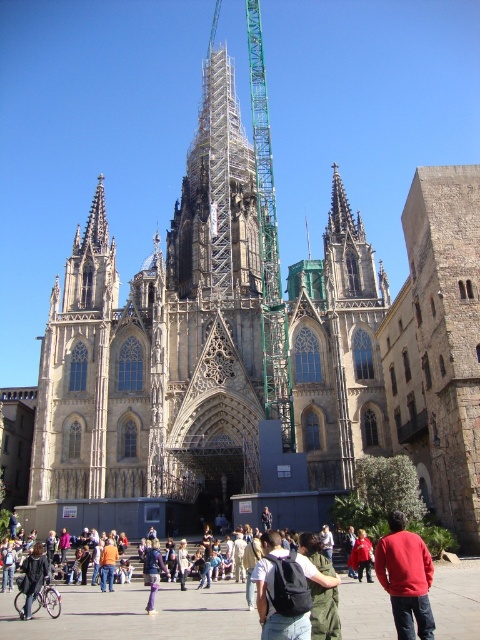
Can you confirm if red cotton sweater at center is positioned below red cotton shirt at center?

No, red cotton sweater at center is not below red cotton shirt at center.

Between point (410, 566) and point (357, 564), which one is positioned in front?

Point (410, 566) is in front.

At what (x,y) coordinates should I click in order to perform the action: click on red cotton sweater at center. Please return your answer as a coordinate pair (x, y). Image resolution: width=480 pixels, height=640 pixels. Looking at the image, I should click on (406, 577).

Which is more to the left, red cotton sweater at center or denim jacket at lower left?

denim jacket at lower left is more to the left.

Can you confirm if red cotton sweater at center is shorter than denim jacket at lower left?

In fact, red cotton sweater at center may be taller than denim jacket at lower left.

Does point (410, 611) come behind point (43, 548)?

No, it is in front of (43, 548).

Identify the location of red cotton sweater at center. This screenshot has width=480, height=640. (406, 577).

Can you confirm if dark green backpack at center is positioned above denim jacket at lower left?

Yes.

Is dark green backpack at center bigger than denim jacket at lower left?

Yes, dark green backpack at center is bigger than denim jacket at lower left.

Is point (288, 582) less distant than point (38, 566)?

That is True.

Locate an element on the screen. dark green backpack at center is located at coordinates (286, 589).